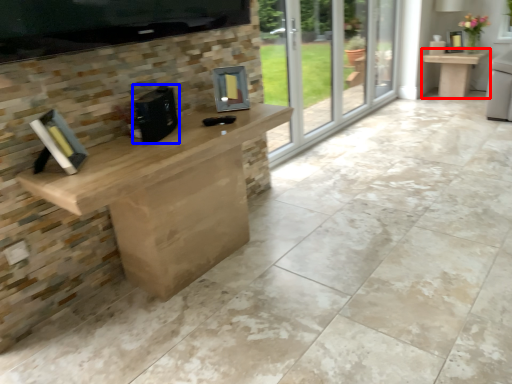
Question: Which point is closer to the camera, table (highlighted by a red box) or appliance (highlighted by a blue box)?

Choices:
 (A) table
 (B) appliance

Answer: (B)